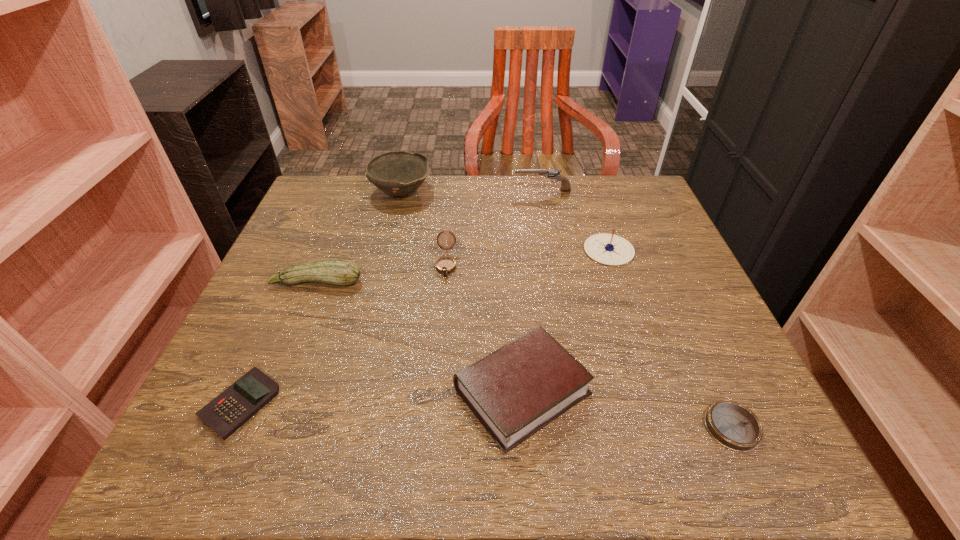
I want to click on gun present at the far edge, so click(x=552, y=174).

Identify the location of Bible located at the near edge. This screenshot has height=540, width=960. (515, 391).

Identify the location of calculator at the near edge. The height and width of the screenshot is (540, 960). (226, 413).

This screenshot has width=960, height=540. I want to click on compass located at the near edge, so click(x=733, y=425).

Where is `bowl at the left edge`? The image size is (960, 540). bowl at the left edge is located at coordinates click(397, 173).

At what (x,y) coordinates should I click in order to perform the action: click on zucchini that is positioned at the left edge. Please return your answer as a coordinate pair (x, y). Looking at the image, I should click on (343, 272).

What are the coordinates of `calculator located at the left edge` in the screenshot? It's located at (226, 413).

This screenshot has height=540, width=960. Find the location of `object present at the far left corner`. object present at the far left corner is located at coordinates (397, 173).

Locate an element on the screen. The height and width of the screenshot is (540, 960). object present at the near left corner is located at coordinates (226, 413).

You are a GUI agent. You are given a task and a screenshot of the screen. Output one action in this format:
    pyautogui.click(x=<x>, y=<y>)
    Task: Click on the object that is at the near right corner
    This screenshot has width=960, height=540.
    Given the screenshot: What is the action you would take?
    pyautogui.click(x=733, y=425)